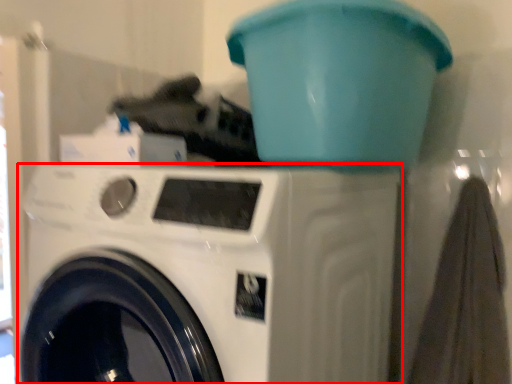
Question: From the image's perspective, where is washing machine (annotated by the red box) located in relation to water cooler in the image?

Choices:
 (A) above
 (B) below

Answer: (B)